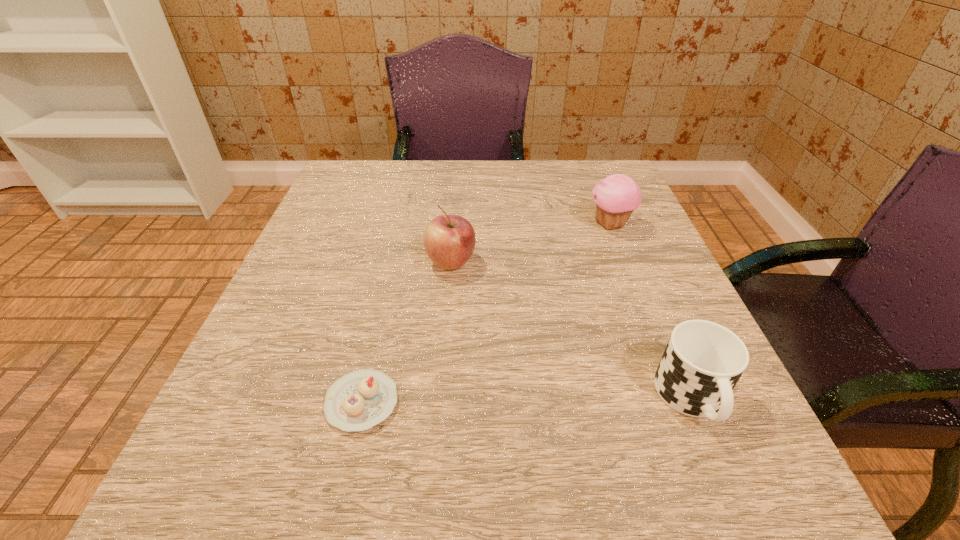
Identify the location of vacant region at the far right corner. (562, 180).

In order to click on free space between the third nearest object and the right cupcake in this screenshot , I will do `click(531, 244)`.

Where is `free space between the cup and the left cupcake`? Image resolution: width=960 pixels, height=540 pixels. free space between the cup and the left cupcake is located at coordinates (527, 401).

Image resolution: width=960 pixels, height=540 pixels. I want to click on vacant space in between the cup and the second object from left to right, so click(571, 330).

This screenshot has height=540, width=960. I want to click on blank region between the right cupcake and the third tallest object, so click(x=651, y=312).

Locate an element on the screen. free space between the second farthest object and the shortest object is located at coordinates (406, 332).

You are a GUI agent. You are given a task and a screenshot of the screen. Output one action in this format:
    pyautogui.click(x=<x>, y=<y>)
    Task: Click on the free spot between the right cupcake and the second shortest object
    The width and height of the screenshot is (960, 540).
    Given the screenshot: What is the action you would take?
    pyautogui.click(x=651, y=312)

I want to click on unoccupied area between the left cupcake and the second shortest object, so click(x=527, y=401).

The height and width of the screenshot is (540, 960). I want to click on free space between the cup and the second object from left to right, so click(x=571, y=330).

What are the coordinates of `vacant space that is in between the second shortest object and the taller cupcake` in the screenshot? It's located at (651, 312).